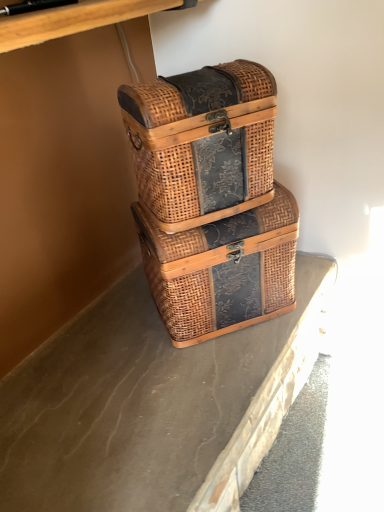
In order to click on free space to the left of woven brown picnic basket at center, which is the second picnic basket in top-to-bottom order in this screenshot , I will do `click(117, 330)`.